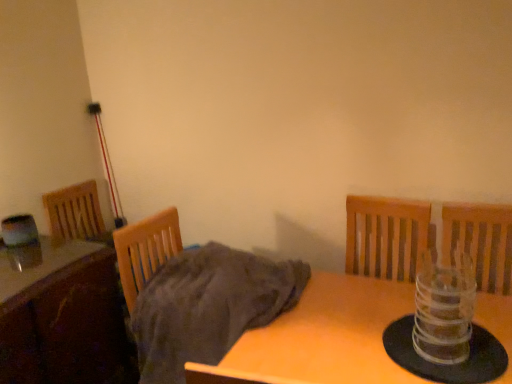
Question: Is gray cotton blanket at center in front of or behind transparent plastic candle holder at right in the image?

Choices:
 (A) front
 (B) behind

Answer: (B)

Question: Based on their sizes in the image, would you say gray cotton blanket at center is bigger or smaller than transparent plastic candle holder at right?

Choices:
 (A) small
 (B) big

Answer: (B)

Question: Which object is the closest to the wooden table at center, which is the 1th table in right-to-left order?

Choices:
 (A) wooden table at lower left, positioned as the 2th table in right-to-left order
 (B) transparent plastic candle holder at right
 (C) gray cotton blanket at center

Answer: (C)

Question: Based on their relative distances, which object is farther from the transparent plastic candle holder at right?

Choices:
 (A) wooden table at lower left, positioned as the 2th table in right-to-left order
 (B) gray cotton blanket at center
 (C) wooden table at center, which is the 1th table in right-to-left order

Answer: (A)